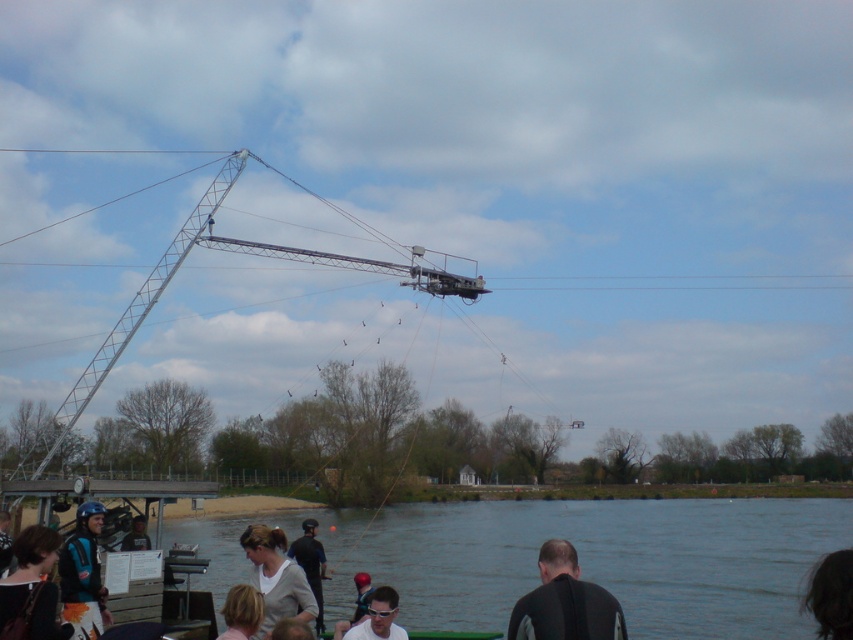
Is smooth water at lower center shorter than dark gray fabric jacket at lower center?

No.

Does smooth water at lower center have a greater height compared to dark gray fabric jacket at lower center?

Yes, smooth water at lower center is taller than dark gray fabric jacket at lower center.

Is point (190, 532) more distant than point (312, 586)?

Yes, point (190, 532) is farther from viewer.

This screenshot has width=853, height=640. Identify the location of smooth water at lower center. (604, 561).

Is dark brown leather jacket at lower left smaller than light gray fabric shirt at lower center?

No.

Who is shorter, dark brown leather jacket at lower left or light gray fabric shirt at lower center?

With less height is dark brown leather jacket at lower left.

The height and width of the screenshot is (640, 853). Describe the element at coordinates (32, 586) in the screenshot. I see `dark brown leather jacket at lower left` at that location.

The width and height of the screenshot is (853, 640). I want to click on dark brown leather jacket at lower left, so click(x=32, y=586).

Who is lower down, dark brown hair at lower right or blonde hair at lower left?

blonde hair at lower left

Is dark brown hair at lower right taller than blonde hair at lower left?

No.

Is point (811, 572) farther from camera compared to point (227, 596)?

No.

The width and height of the screenshot is (853, 640). Identify the location of dark brown hair at lower right. (831, 595).